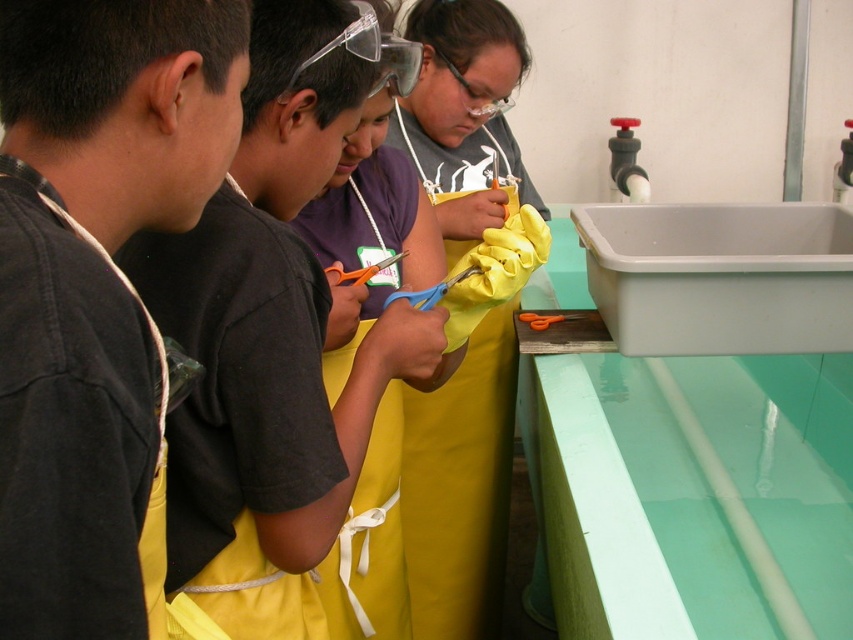
Question: Is yellow fabric apron at center to the left of orange plastic scissors at center from the viewer's perspective?

Choices:
 (A) no
 (B) yes

Answer: (B)

Question: Which of these objects is positioned farthest from the blue plastic scissors at center?

Choices:
 (A) yellow fabric apron at center
 (B) orange plastic scissors at center
 (C) black fabric apron at left

Answer: (C)

Question: Which point appears farthest from the camera in this image?

Choices:
 (A) (389, 259)
 (B) (701, 220)

Answer: (B)

Question: Can you confirm if yellow rubber gloves at center is wider than orange plastic scissors at center?

Choices:
 (A) no
 (B) yes

Answer: (B)

Question: Estimate the real-world distances between objects in this image. Which object is closer to the yellow rubber gloves at center?

Choices:
 (A) white plastic sink at right
 (B) orange plastic scissors at center

Answer: (A)

Question: Is white plastic sink at right further to the viewer compared to orange plastic scissors at center?

Choices:
 (A) no
 (B) yes

Answer: (B)